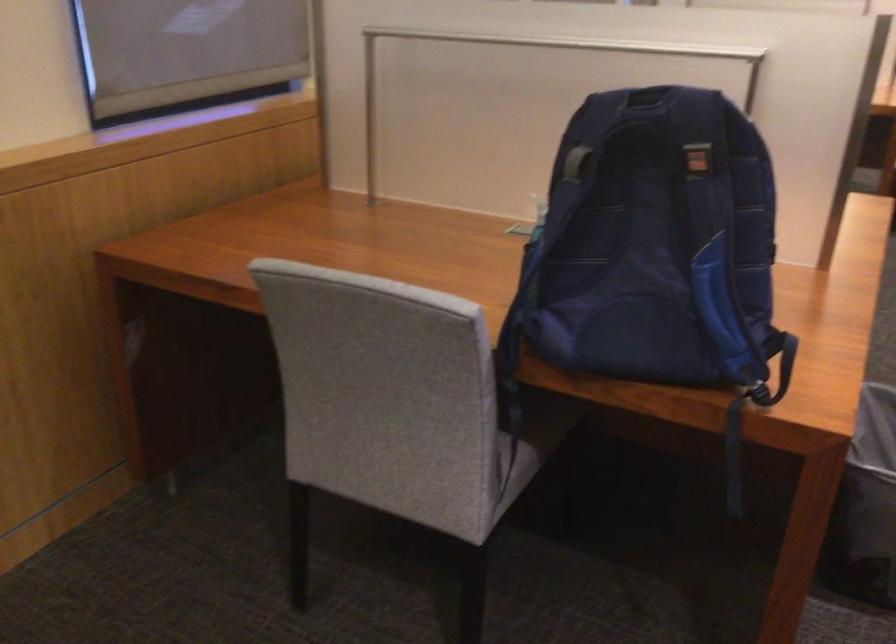
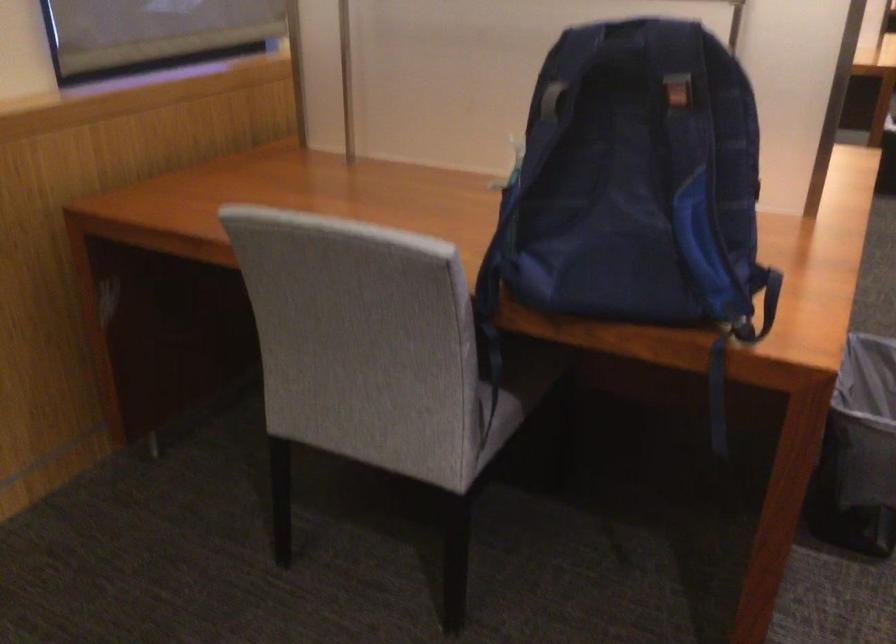
The point at (734,455) is marked in the first image. Where is the corresponding point in the second image?

(718, 395)